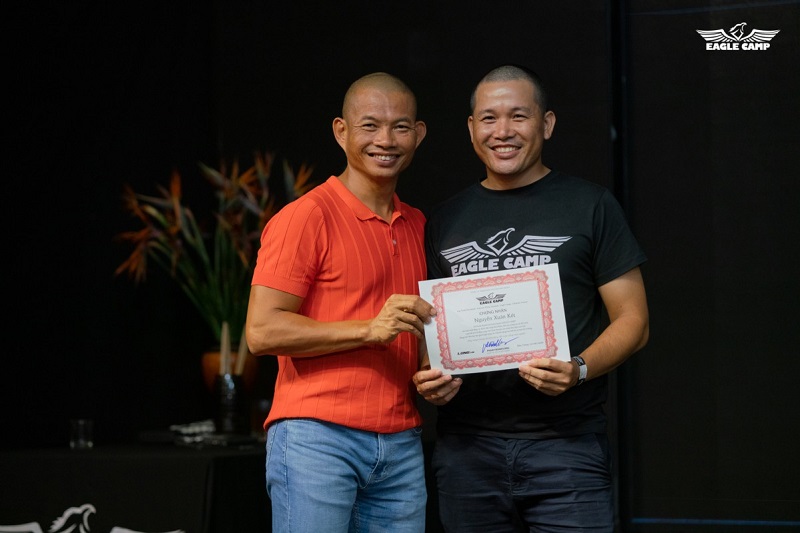
Where is `ceramic planter`? This screenshot has width=800, height=533. ceramic planter is located at coordinates (225, 389).